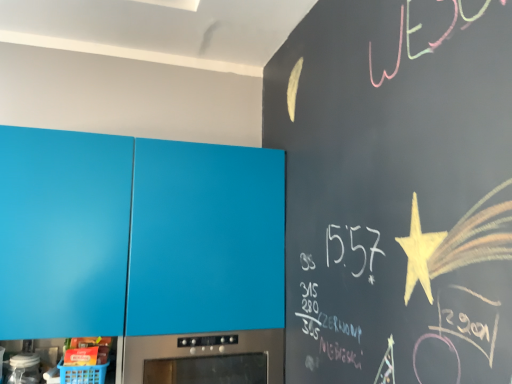
Question: Considering the positions of matte blue cabinet at left and satin silver oven at lower center in the image, is matte blue cabinet at left wider or thinner than satin silver oven at lower center?

Choices:
 (A) thin
 (B) wide

Answer: (A)

Question: From a real-world perspective, relative to satin silver oven at lower center, is matte blue cabinet at left vertically above or below?

Choices:
 (A) below
 (B) above

Answer: (B)

Question: In terms of size, does matte blue cabinet at left appear bigger or smaller than satin silver oven at lower center?

Choices:
 (A) small
 (B) big

Answer: (B)

Question: Considering their positions, is satin silver oven at lower center located in front of or behind matte blue cabinet at left?

Choices:
 (A) front
 (B) behind

Answer: (B)

Question: From a real-world perspective, is satin silver oven at lower center positioned above or below matte blue cabinet at left?

Choices:
 (A) below
 (B) above

Answer: (A)

Question: Considering the positions of point (253, 342) and point (61, 254), is point (253, 342) closer or farther from the camera than point (61, 254)?

Choices:
 (A) closer
 (B) farther

Answer: (B)

Question: Looking at their shapes, would you say satin silver oven at lower center is wider or thinner than matte blue cabinet at left?

Choices:
 (A) thin
 (B) wide

Answer: (B)